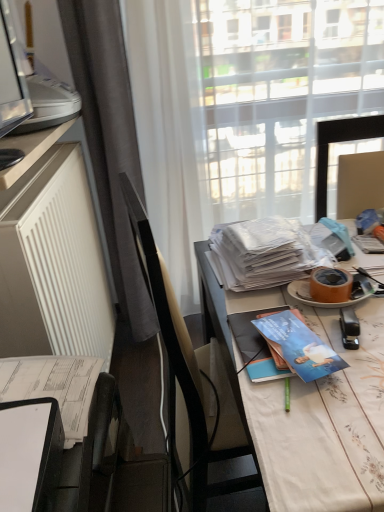
Question: Does white paper journal at lower left appear on the left side of blue glossy book at center?

Choices:
 (A) no
 (B) yes

Answer: (B)

Question: Can you confirm if white paper journal at lower left is shorter than blue glossy book at center?

Choices:
 (A) yes
 (B) no

Answer: (B)

Question: From the image's perspective, is white paper journal at lower left above blue glossy book at center?

Choices:
 (A) yes
 (B) no

Answer: (B)

Question: Can you confirm if white paper journal at lower left is smaller than blue glossy book at center?

Choices:
 (A) no
 (B) yes

Answer: (A)

Question: Is white paper journal at lower left touching blue glossy book at center?

Choices:
 (A) no
 (B) yes

Answer: (A)

Question: Does white paper journal at lower left have a lesser width compared to blue glossy book at center?

Choices:
 (A) yes
 (B) no

Answer: (A)

Question: Can you confirm if white glossy magazine at center, the 1th magazine when ordered from back to front, is positioned to the left of blue glossy book at center, which ranks as the first magazine in front-to-back order?

Choices:
 (A) no
 (B) yes

Answer: (A)

Question: Can you confirm if white glossy magazine at center, acting as the 1th magazine starting from the top, is taller than blue glossy book at center, which ranks as the first magazine in front-to-back order?

Choices:
 (A) no
 (B) yes

Answer: (B)

Question: Does white glossy magazine at center, the 1th magazine when ordered from back to front, appear on the right side of blue glossy book at center, the 1th magazine when ordered from bottom to top?

Choices:
 (A) no
 (B) yes

Answer: (B)

Question: Considering the relative positions of white glossy magazine at center, the 1th magazine when ordered from back to front, and blue glossy book at center, the 1th magazine when ordered from bottom to top, in the image provided, is white glossy magazine at center, the 1th magazine when ordered from back to front, in front of blue glossy book at center, the 1th magazine when ordered from bottom to top,?

Choices:
 (A) yes
 (B) no

Answer: (B)

Question: Considering the relative sizes of white glossy magazine at center, which is the second magazine in bottom-to-top order, and blue glossy book at center, which ranks as the first magazine in front-to-back order, in the image provided, is white glossy magazine at center, which is the second magazine in bottom-to-top order, thinner than blue glossy book at center, which ranks as the first magazine in front-to-back order,?

Choices:
 (A) no
 (B) yes

Answer: (A)

Question: From a real-world perspective, is white glossy magazine at center, which is the second magazine in bottom-to-top order, over blue glossy book at center, the 1th magazine when ordered from bottom to top?

Choices:
 (A) yes
 (B) no

Answer: (A)

Question: Are white plastic printer at upper left and white matte radiator at left making contact?

Choices:
 (A) yes
 (B) no

Answer: (B)